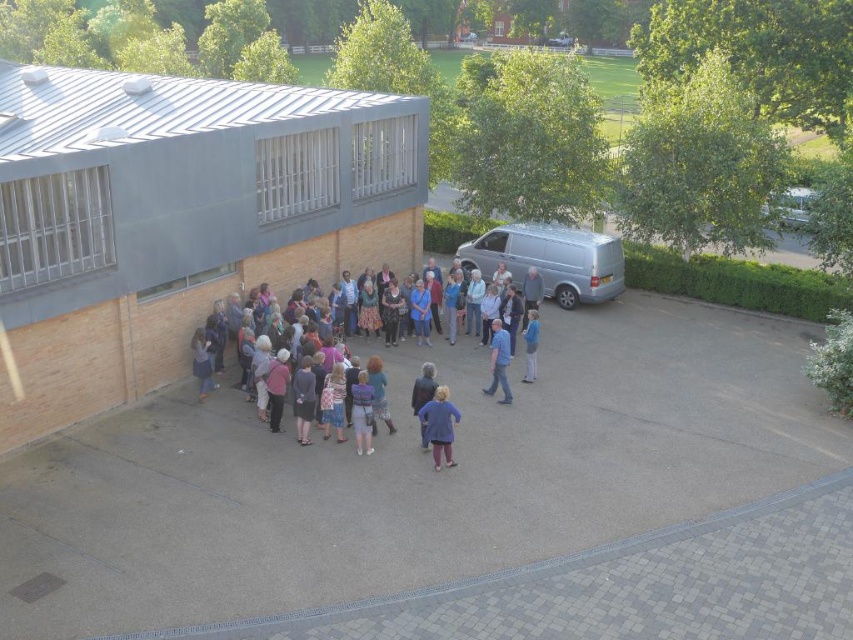
Question: Estimate the real-world distances between objects in this image. Which object is farther from the matte brick building at center?

Choices:
 (A) purple fabric jacket at center
 (B) silver metallic van at center

Answer: (A)

Question: Can you confirm if matte brick building at center is wider than multicolored casual attire at center?

Choices:
 (A) no
 (B) yes

Answer: (B)

Question: Which object is farther from the camera taking this photo?

Choices:
 (A) matte brick building at center
 (B) white metallic van at upper right
 (C) purple fabric jacket at center

Answer: (B)

Question: Is multicolored casual attire at center bigger than blue jeans at center?

Choices:
 (A) no
 (B) yes

Answer: (A)

Question: Is silver metallic van at center positioned in front of blue jeans at center?

Choices:
 (A) no
 (B) yes

Answer: (A)

Question: Which point appears closest to the camera in this image?

Choices:
 (A) (788, 198)
 (B) (102, 172)

Answer: (B)